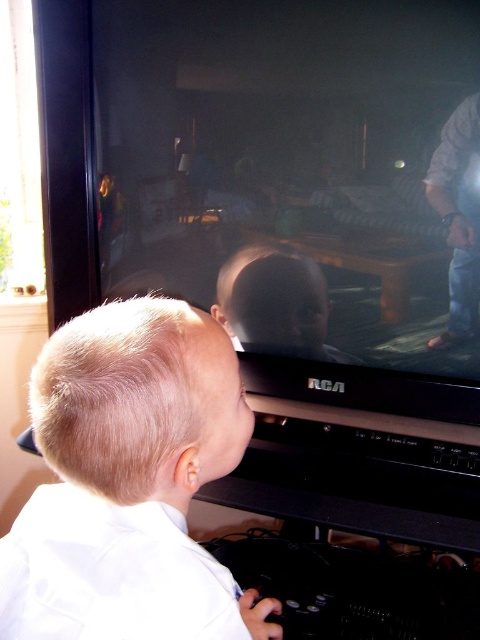
Question: Can you confirm if blonde hair boy at lower left is positioned to the right of smooth plastic baby at center?

Choices:
 (A) no
 (B) yes

Answer: (A)

Question: Does blonde hair boy at lower left appear under smooth plastic baby at center?

Choices:
 (A) no
 (B) yes

Answer: (B)

Question: Which object is closer to the camera taking this photo?

Choices:
 (A) smooth plastic baby at center
 (B) blonde hair boy at lower left

Answer: (B)

Question: Can you confirm if blonde hair boy at lower left is bigger than smooth plastic baby at center?

Choices:
 (A) no
 (B) yes

Answer: (B)